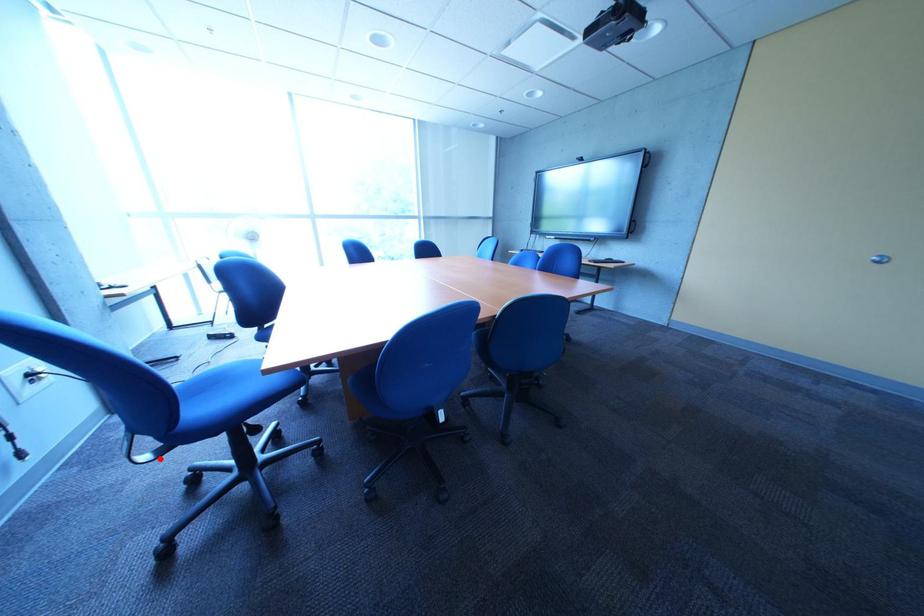
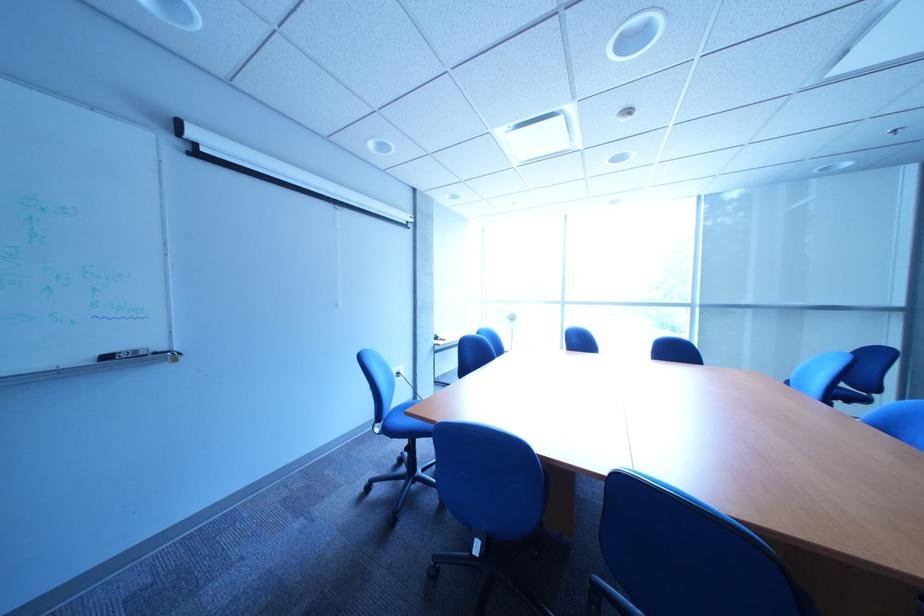
Locate, in the second image, the point that corresponds to the highlighted location in the first image.

(392, 432)